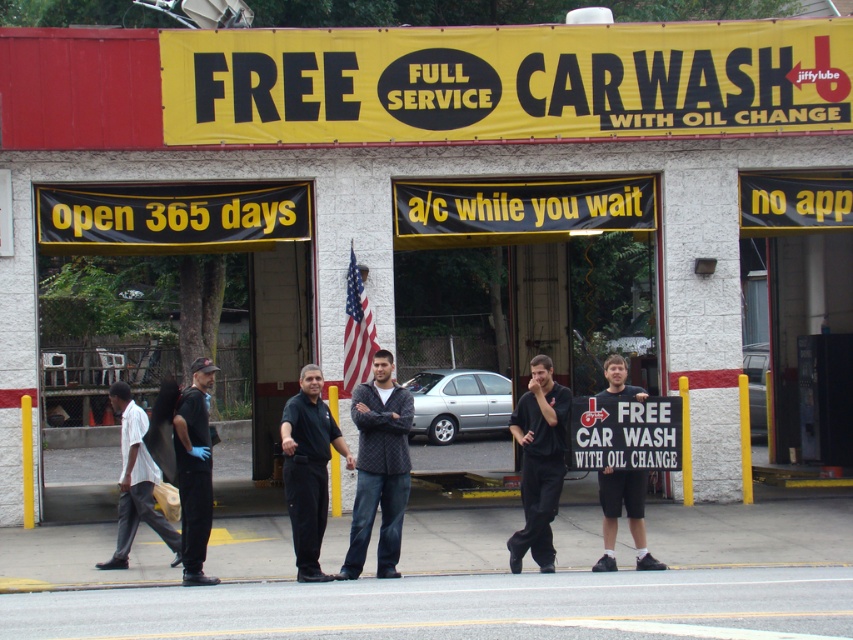
Question: Does black matte shirt at center appear over white plastic sign at center?

Choices:
 (A) yes
 (B) no

Answer: (B)

Question: Among these points, which one is nearest to the camera?

Choices:
 (A) 321,465
 (B) 546,376
 (C) 602,394
 (D) 387,509

Answer: (A)

Question: Does white plastic sign at center appear on the left side of black cotton t-shirt at center?

Choices:
 (A) yes
 (B) no

Answer: (B)

Question: Which object is the farthest from the black cotton t-shirt at center?

Choices:
 (A) white cotton shirt at left
 (B) black matte shirt at center
 (C) white plastic sign at center

Answer: (A)

Question: Can you confirm if black matte shirt at center is smaller than white plastic sign at center?

Choices:
 (A) no
 (B) yes

Answer: (A)

Question: Which point is farther from the camera taking this photo?

Choices:
 (A) (308, 369)
 (B) (207, 381)
 (C) (646, 461)
 (D) (640, 512)

Answer: (C)